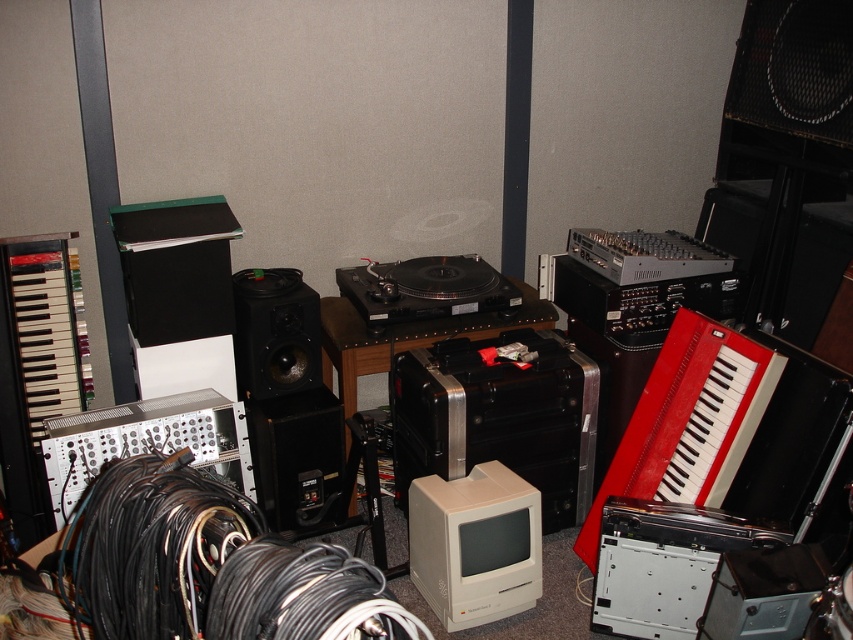
Is white matte accordion at left shorter than black matte speaker at center?

Incorrect, white matte accordion at left's height does not fall short of black matte speaker at center's.

Is white matte accordion at left to the left of black matte speaker at center from the viewer's perspective?

Correct, you'll find white matte accordion at left to the left of black matte speaker at center.

Image resolution: width=853 pixels, height=640 pixels. What do you see at coordinates (45, 326) in the screenshot?
I see `white matte accordion at left` at bounding box center [45, 326].

Locate an element on the screen. Image resolution: width=853 pixels, height=640 pixels. white matte accordion at left is located at coordinates 45,326.

Which is more to the left, black rubber wires at lower center or white matte accordion at left?

Positioned to the left is white matte accordion at left.

Does black rubber wires at lower center have a larger size compared to white matte accordion at left?

Yes.

Is point (254, 609) in front of point (83, 330)?

Yes, point (254, 609) is closer to viewer.

Locate an element on the screen. black rubber wires at lower center is located at coordinates (210, 566).

From the picture: Is metallic black stereo at center shorter than silver metallic modular synthesizer at lower left?

No, metallic black stereo at center is not shorter than silver metallic modular synthesizer at lower left.

Which is in front, point (393, 474) or point (96, 451)?

Point (96, 451) is more forward.

Identify the location of metallic black stereo at center. (498, 419).